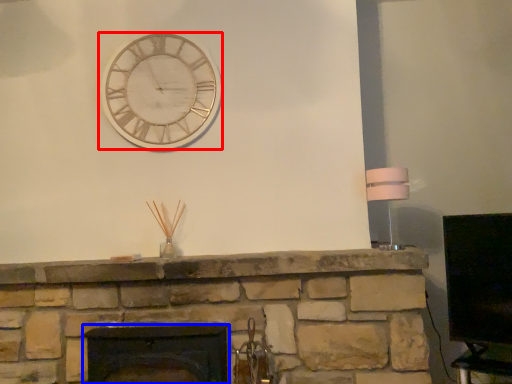
Question: Which object is closer to the camera taking this photo, wall clock (highlighted by a red box) or fireplace (highlighted by a blue box)?

Choices:
 (A) wall clock
 (B) fireplace

Answer: (B)